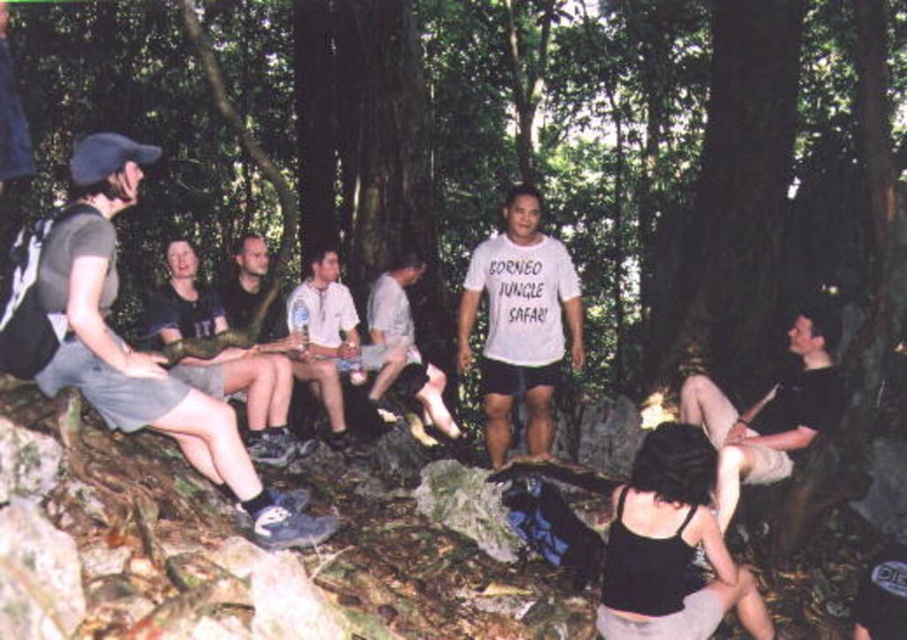
Question: Which object appears closest to the camera in this image?

Choices:
 (A) black cotton shirt at lower right
 (B) white cotton shirt at center
 (C) dark gray fabric shorts at left
 (D) dark brown leather jacket at center

Answer: (C)

Question: Which point is farther to the camera?

Choices:
 (A) white cotton t-shirt at center
 (B) camouflage fabric snake at center

Answer: (A)

Question: Among these points, which one is farthest from the camera?

Choices:
 (A) (340, 340)
 (B) (821, 394)
 (C) (275, 294)

Answer: (A)

Question: Does camouflage fabric snake at center have a lesser width compared to dark brown leather jacket at center?

Choices:
 (A) no
 (B) yes

Answer: (A)

Question: Is the position of white cotton t-shirt at center less distant than that of white cotton shirt at center?

Choices:
 (A) no
 (B) yes

Answer: (B)

Question: Is white cotton t-shirt at center further to camera compared to black cotton shirt at lower right?

Choices:
 (A) yes
 (B) no

Answer: (A)